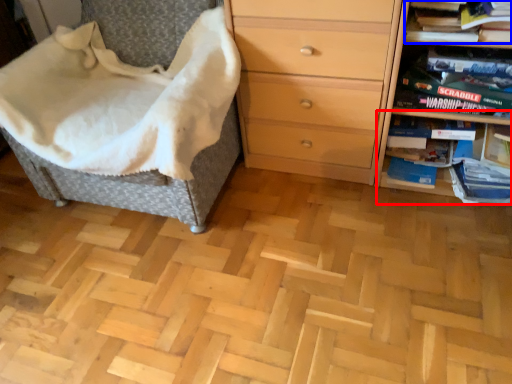
Question: Which object appears farthest to the camera in this image, shelf (highlighted by a red box) or book (highlighted by a blue box)?

Choices:
 (A) shelf
 (B) book

Answer: (A)